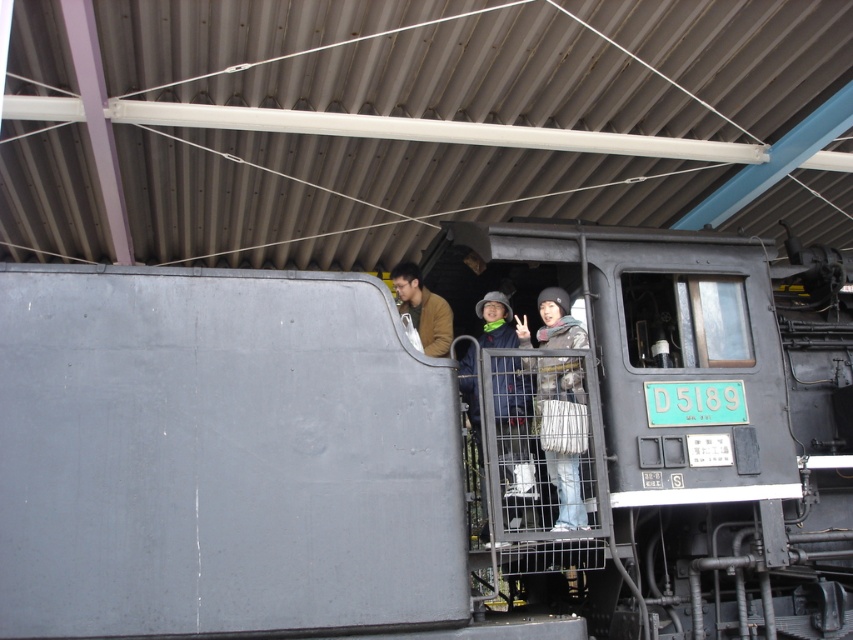
Which is behind, point (798, 353) or point (462, 364)?

Positioned behind is point (462, 364).

From the picture: Is matte black train at center smaller than matte gray jacket at center?

No.

Is point (212, 312) behind point (489, 324)?

No, (212, 312) is in front of (489, 324).

You are a GUI agent. You are given a task and a screenshot of the screen. Output one action in this format:
    pyautogui.click(x=<x>, y=<y>)
    Task: Click on the matte black train at center
    The height and width of the screenshot is (640, 853).
    Given the screenshot: What is the action you would take?
    pyautogui.click(x=433, y=444)

Is point (509, 316) positioned behind point (436, 307)?

No, it is not.

This screenshot has height=640, width=853. I want to click on matte gray jacket at center, so click(509, 394).

Where is `matte gray jacket at center`? matte gray jacket at center is located at coordinates (509, 394).

Who is more forward, (224, 547) or (402, 282)?

Positioned in front is point (224, 547).

Find the location of a particular element. The image size is (853, 640). matte black train at center is located at coordinates (433, 444).